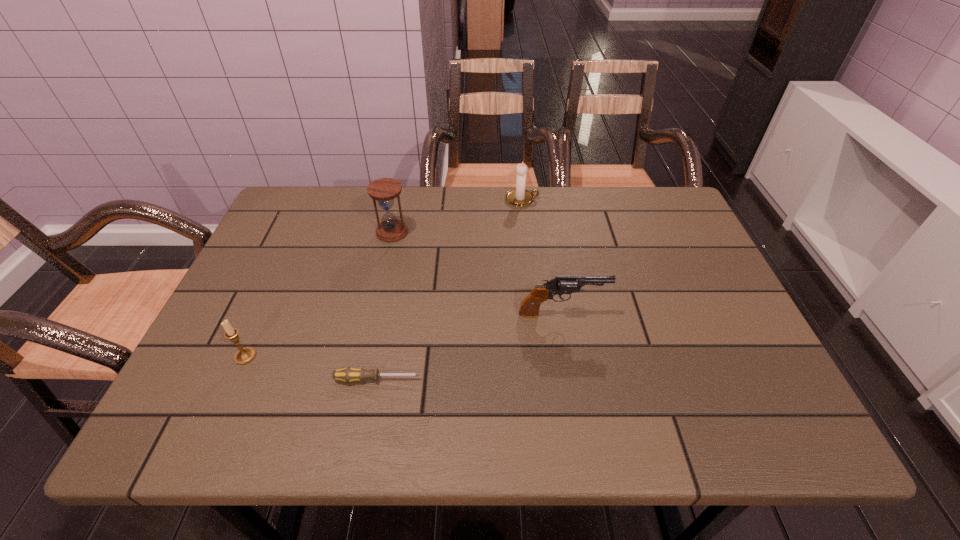
Where is `the second farthest object`? Image resolution: width=960 pixels, height=540 pixels. the second farthest object is located at coordinates (384, 190).

Identify the location of the farthest object. Image resolution: width=960 pixels, height=540 pixels. (520, 196).

What are the coordinates of `the farther candle holder` in the screenshot? It's located at (520, 196).

Where is `the third farthest object`? the third farthest object is located at coordinates (560, 285).

Where is `the second nearest object`? the second nearest object is located at coordinates pos(245,355).

This screenshot has width=960, height=540. Find the location of `the left candle holder`. the left candle holder is located at coordinates (245, 355).

The width and height of the screenshot is (960, 540). I want to click on the nearest object, so click(349, 374).

Find the location of `the shortest object`. the shortest object is located at coordinates (349, 374).

At what (x,y) coordinates should I click in order to perform the action: click on free location located on the right of the fourth nearest object. Please return your answer as a coordinate pair (x, y). Looking at the image, I should click on (426, 232).

Locate an element on the screen. The height and width of the screenshot is (540, 960). vacant space located on the handle side of the farthest object is located at coordinates (555, 199).